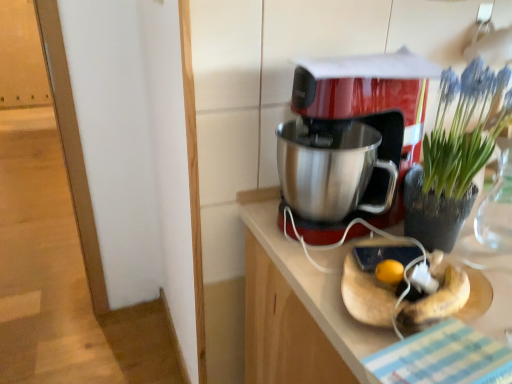
Image resolution: width=512 pixels, height=384 pixels. Identify the location of free spot above stainless steel countertop at center (from a real-world perspective). (383, 279).